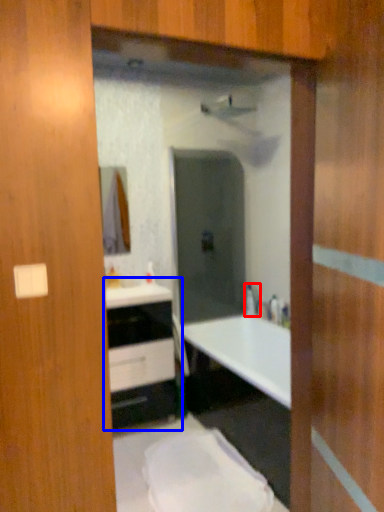
Question: Which of the following is the farthest to the observer, faucet (highlighted by a red box) or bathroom cabinet (highlighted by a blue box)?

Choices:
 (A) faucet
 (B) bathroom cabinet

Answer: (A)